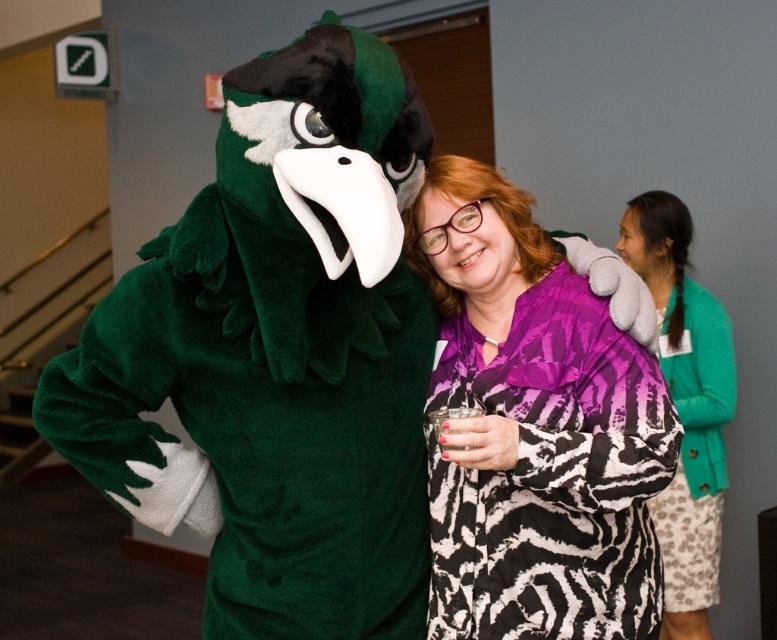
Can you confirm if purple printed shirt at center is thinner than green fuzzy sweater at right?

No, purple printed shirt at center is not thinner than green fuzzy sweater at right.

Is purple printed shirt at center closer to camera compared to green fuzzy sweater at right?

Yes, purple printed shirt at center is closer to the viewer.

Who is more distant from viewer, (608, 560) or (687, 426)?

Point (687, 426)

Identify the location of purple printed shirt at center. [x=532, y=428].